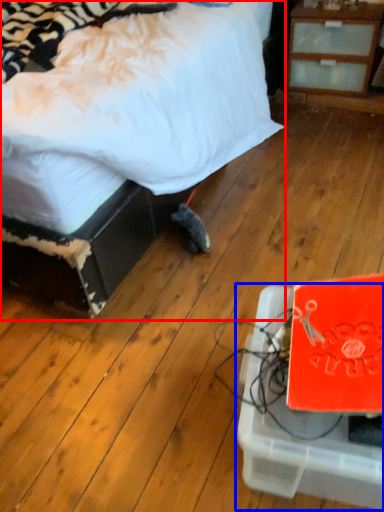
Question: Among these objects, which one is farthest to the camera, bed (highlighted by a red box) or cardboard box (highlighted by a blue box)?

Choices:
 (A) bed
 (B) cardboard box

Answer: (A)